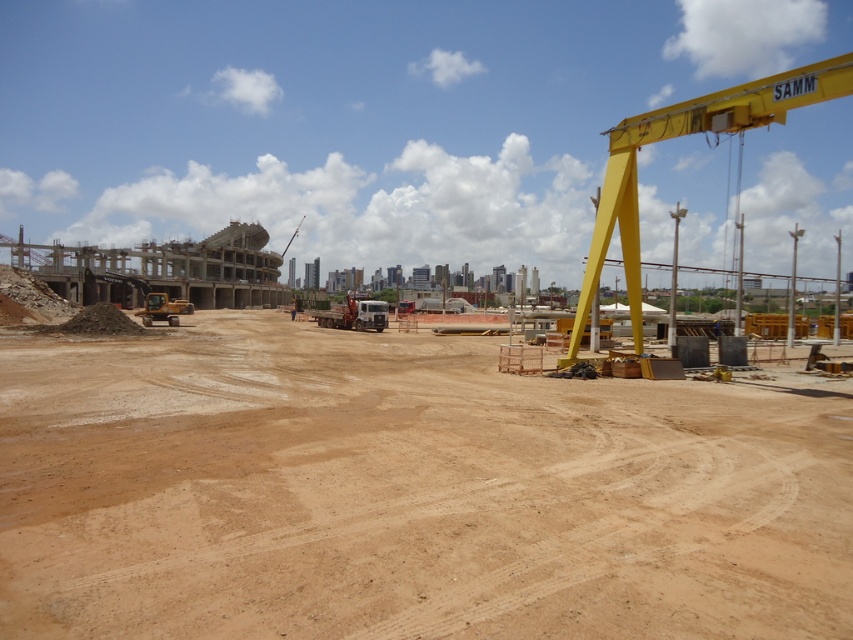
Can you confirm if brown sandy dirt at center is positioned to the right of matte white truck at center?

Yes, brown sandy dirt at center is to the right of matte white truck at center.

Can you confirm if brown sandy dirt at center is smaller than matte white truck at center?

Yes, brown sandy dirt at center is smaller than matte white truck at center.

Locate an element on the screen. The image size is (853, 640). brown sandy dirt at center is located at coordinates (407, 492).

Between point (347, 326) and point (163, 314), which one is positioned in front?

Positioned in front is point (163, 314).

Is matte white truck at center above metallic yellow excavator at center-left?

Correct, matte white truck at center is located above metallic yellow excavator at center-left.

Looking at this image, who is more distant from viewer, (x=363, y=323) or (x=120, y=275)?

The point (x=120, y=275) is behind.

The image size is (853, 640). In order to click on matte white truck at center in this screenshot , I will do `click(354, 314)`.

Can you confirm if brown sandy dirt at center is wider than yellow metallic crane at upper right?

Yes.

Which is more to the right, brown sandy dirt at center or yellow metallic crane at upper right?

yellow metallic crane at upper right

The image size is (853, 640). Describe the element at coordinates (407, 492) in the screenshot. I see `brown sandy dirt at center` at that location.

This screenshot has height=640, width=853. Find the location of `brown sandy dirt at center`. brown sandy dirt at center is located at coordinates (407, 492).